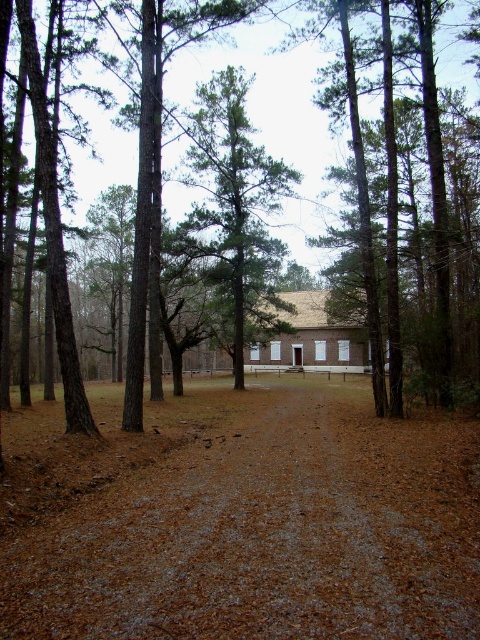
Question: Considering the relative positions of brown gravel path at center and green leafy tree at center in the image provided, where is brown gravel path at center located with respect to green leafy tree at center?

Choices:
 (A) above
 (B) below

Answer: (B)

Question: Among these objects, which one is farthest from the camera?

Choices:
 (A) green leafy tree at center
 (B) brown rough tree at center

Answer: (B)

Question: Can you confirm if brown rough tree at center is smaller than brown brick barn at center?

Choices:
 (A) yes
 (B) no

Answer: (B)

Question: Does green leafy tree at center appear on the right side of brown brick barn at center?

Choices:
 (A) yes
 (B) no

Answer: (B)

Question: Which of these objects is positioned farthest from the brown rough tree at center?

Choices:
 (A) green leafy tree at center
 (B) brown brick barn at center
 (C) brown gravel path at center

Answer: (C)

Question: Which is nearer to the brown gravel path at center?

Choices:
 (A) brown rough tree at center
 (B) brown brick barn at center

Answer: (B)